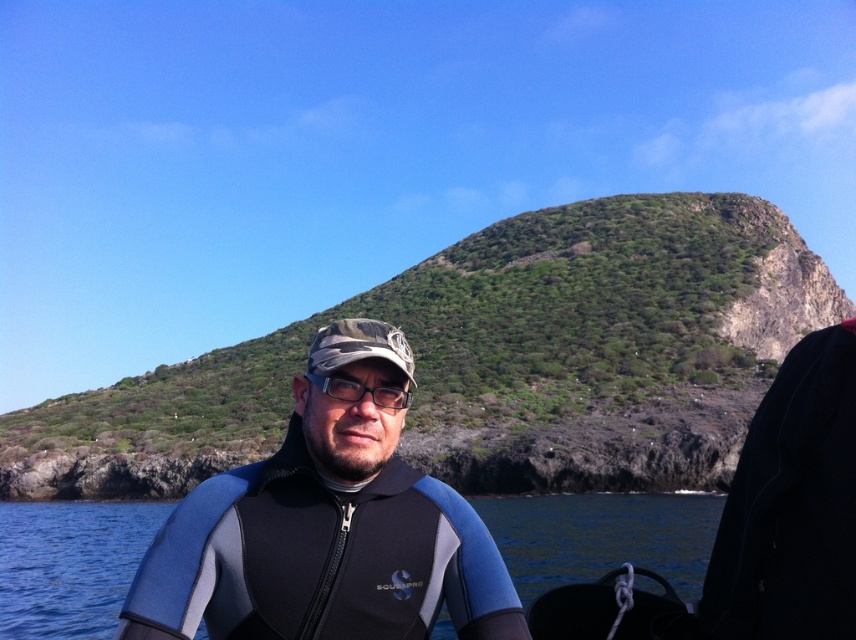
You are a drone operator tasked with capturing aerial footage of the scene. The point at (x=311, y=403) is a marker for a specific location. If you need to fly your drone from the person to this point, how far will the drone have to travel?

The distance between the person and the point at (x=311, y=403) is 29.34 meters, so the drone will have to travel 29.34 meters.

You are a drone operator trying to capture the best aerial shot of the blue matte water at center. The drone is currently hovering at point (601,536). Can you confirm if the blue matte water at center is directly below the drone?

The blue matte water at center is located at point (601,536), so yes, the drone is directly above the blue matte water at center and can capture it from above.

You are a scuba diver who just surfaced from the water and is now standing on the boat. You have your transparent plastic glasses at center on your face. Where is the blue matte water at center in relation to your glasses?

The blue matte water at center is below the transparent plastic glasses at center, so the water is positioned beneath your glasses.